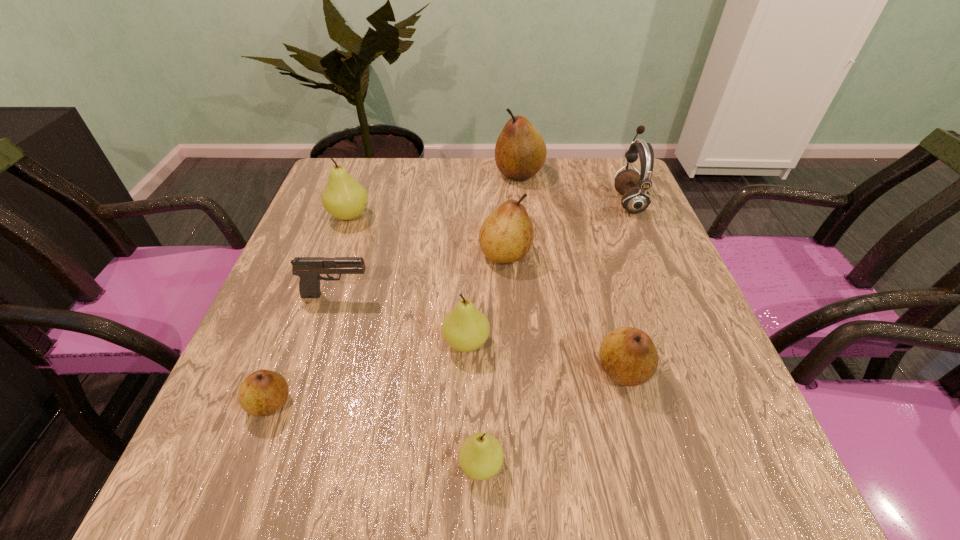
Identify which pear is the sixth closest to the farthest pear. Please provide its 2D coordinates. Your answer should be formatted as a tuple, i.e. [(x, y)], where the tuple contains the x and y coordinates of a point satisfying the conditions above.

[(480, 457)]

Select which pear appears as the fourth closest to the second smallest brown pear. Please provide its 2D coordinates. Your answer should be formatted as a tuple, i.e. [(x, y)], where the tuple contains the x and y coordinates of a point satisfying the conditions above.

[(263, 392)]

I want to click on brown pear that stands as the fourth closest to the leftmost green pear, so click(x=628, y=355).

Identify which brown pear is the third nearest to the second biggest brown pear. Please provide its 2D coordinates. Your answer should be formatted as a tuple, i.e. [(x, y)], where the tuple contains the x and y coordinates of a point satisfying the conditions above.

[(263, 392)]

Locate which green pear is the third closest to the smallest brown pear. Please provide its 2D coordinates. Your answer should be formatted as a tuple, i.e. [(x, y)], where the tuple contains the x and y coordinates of a point satisfying the conditions above.

[(344, 198)]

Locate which green pear is the second closest to the third farthest pear. Please provide its 2D coordinates. Your answer should be formatted as a tuple, i.e. [(x, y)], where the tuple contains the x and y coordinates of a point satisfying the conditions above.

[(344, 198)]

Find the location of `vacant area in the image that satisfies the following two spatial constraints: 1. on the back side of the second smallest green pear; 2. aim along the barrel of the fifth farthest object`. vacant area in the image that satisfies the following two spatial constraints: 1. on the back side of the second smallest green pear; 2. aim along the barrel of the fifth farthest object is located at coordinates (468, 295).

At what (x,y) coordinates should I click in order to perform the action: click on vacant space that satisfies the following two spatial constraints: 1. on the front side of the leftmost green pear; 2. on the right side of the second farthest brown pear. Please return your answer as a coordinate pair (x, y). Looking at the image, I should click on click(335, 254).

Where is `vacant space that satisfies the following two spatial constraints: 1. aim along the barrel of the fifth farthest object; 2. on the back side of the second smallest brown pear`? This screenshot has width=960, height=540. vacant space that satisfies the following two spatial constraints: 1. aim along the barrel of the fifth farthest object; 2. on the back side of the second smallest brown pear is located at coordinates (312, 370).